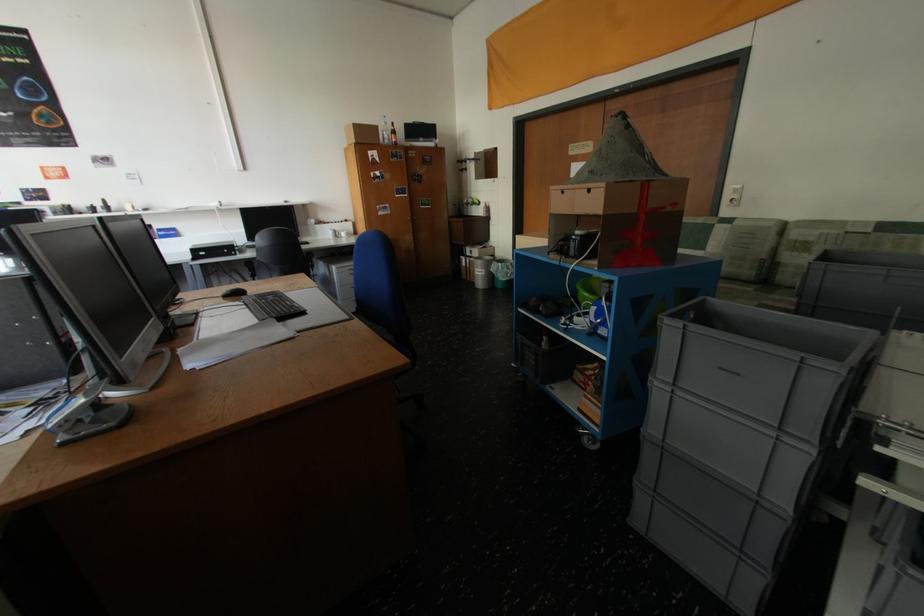
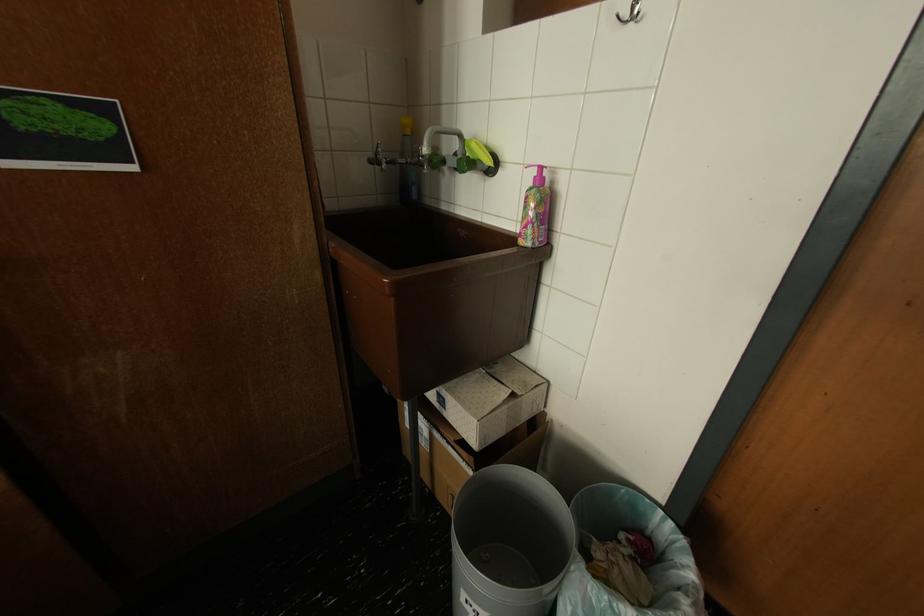
Find the pixel in the second image that matches [476,205] in the first image.

(445, 163)